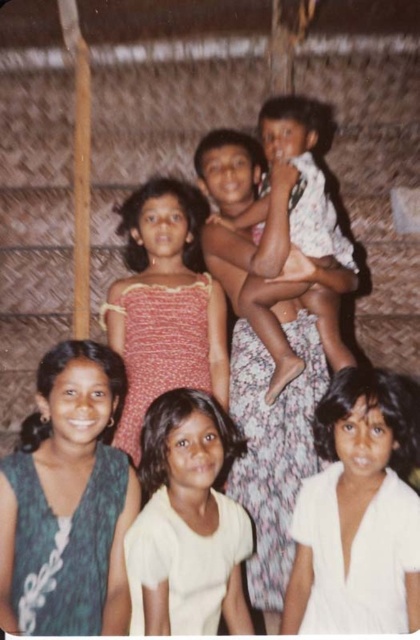
You are a photographer trying to arrange the children for a group photo. You need to place the white matte dress at lower right and the floral fabric dress at center in a way that follows their current positions. Which child should be positioned to the right of the other?

The white matte dress at lower right should be positioned to the right of the floral fabric dress at center.

You are a photographer trying to capture a closeup of the floral fabric baby at center and the matte pink dress at center. Which one should you focus on first if you want to ensure both are in focus?

The floral fabric baby at center is positioned on the right side of matte pink dress at center, so you should focus on the matte pink dress at center first to ensure both are in focus.